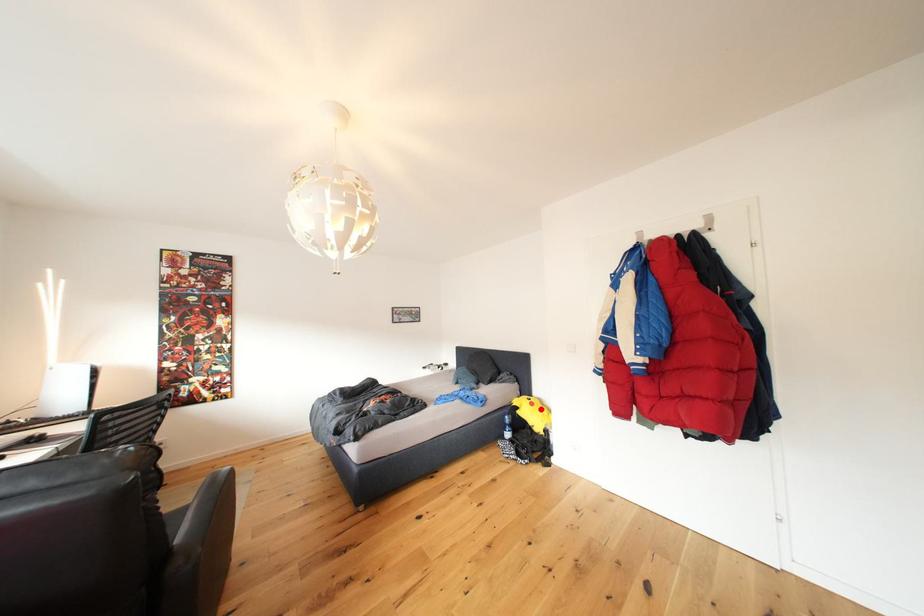
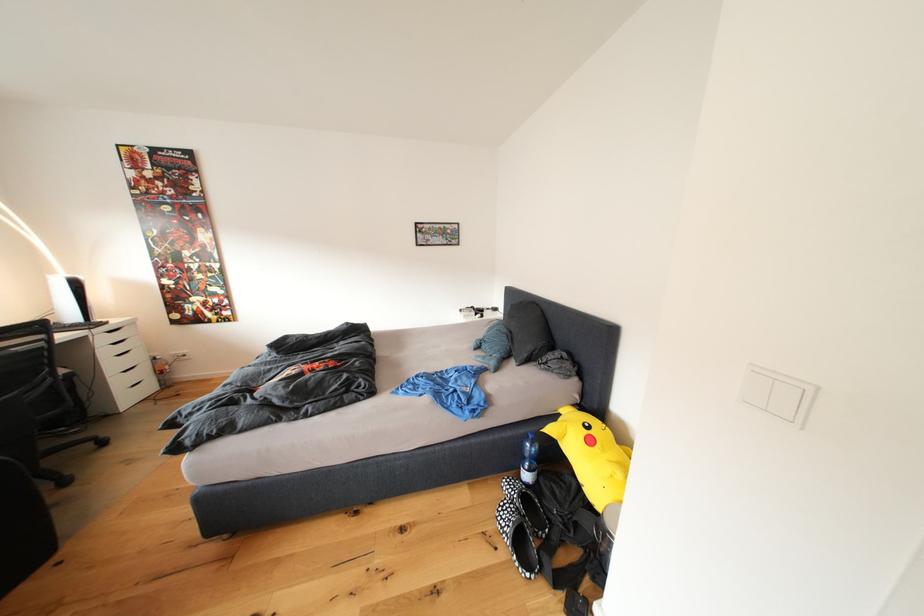
In the second image, find the point that corresponds to the highlighted location in the first image.

(600, 446)